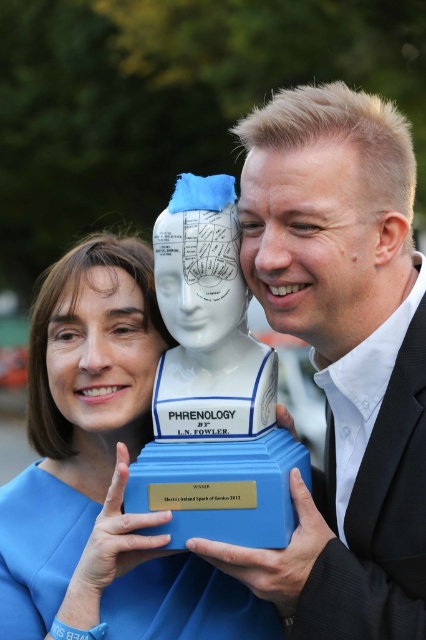
You are standing in front of the image and want to know how far the point at coordinates point [362,163] is from you. Can you determine the distance?

The distance of point [362,163] from camera is 2.22 meters.

You are a photographer standing 10 feet away from the white glossy bust at center and the blue plastic bust at center. You want to take a photo that captures both busts in the frame without any part of them being cut off. Given that your camera has a maximum field of view of 8 inches, will you be able to fit both busts into the photo?

The distance between the white glossy bust at center and the blue plastic bust at center is 7.70 inches, which is less than the camera field of view of 8 inches. Therefore, both busts can be captured in the photo without any part being cut off.

You are a photographer taking a picture of the blue fabric dress at center and the blue plastic bust at center. Which object should you focus on first if you want to capture both in sharp focus?

The blue fabric dress at center is located below the blue plastic bust at center, so you should focus on the blue plastic bust at center first to ensure both are in sharp focus.